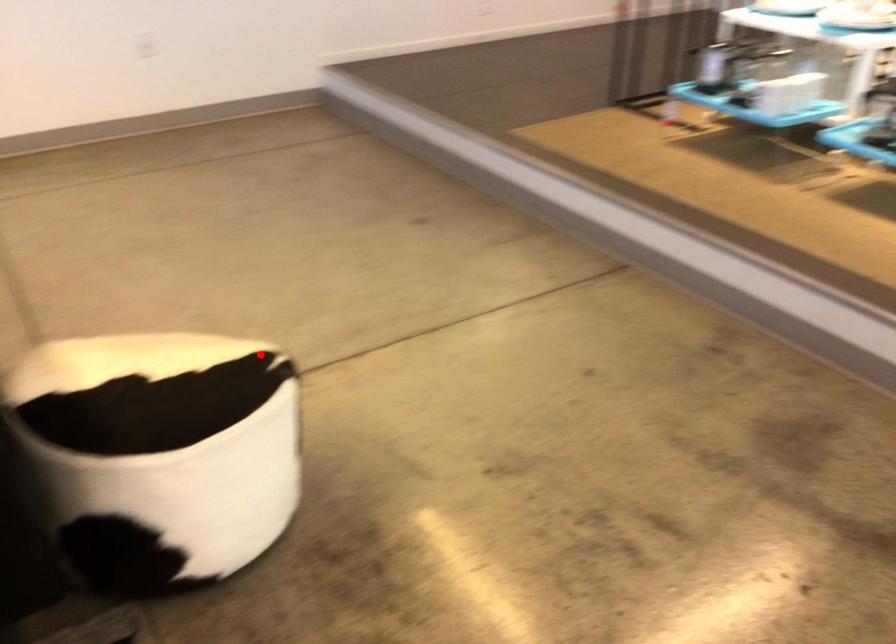
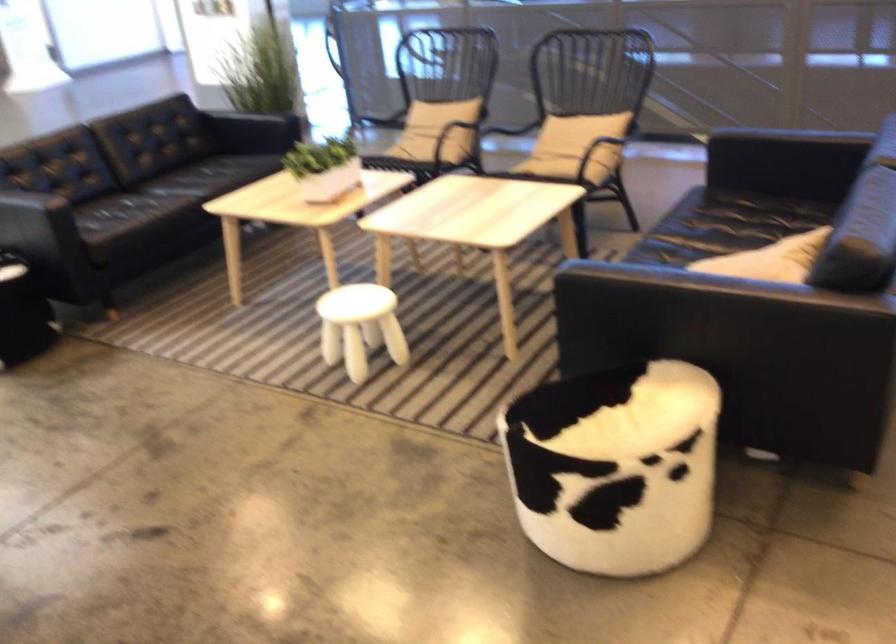
Where in the second image is the point corresponding to the highlighted location from the first image?

(615, 466)